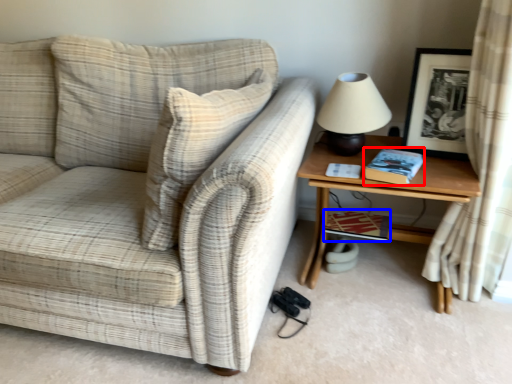
Question: Which point is closer to the camera, book (highlighted by a red box) or book (highlighted by a blue box)?

Choices:
 (A) book
 (B) book

Answer: (A)